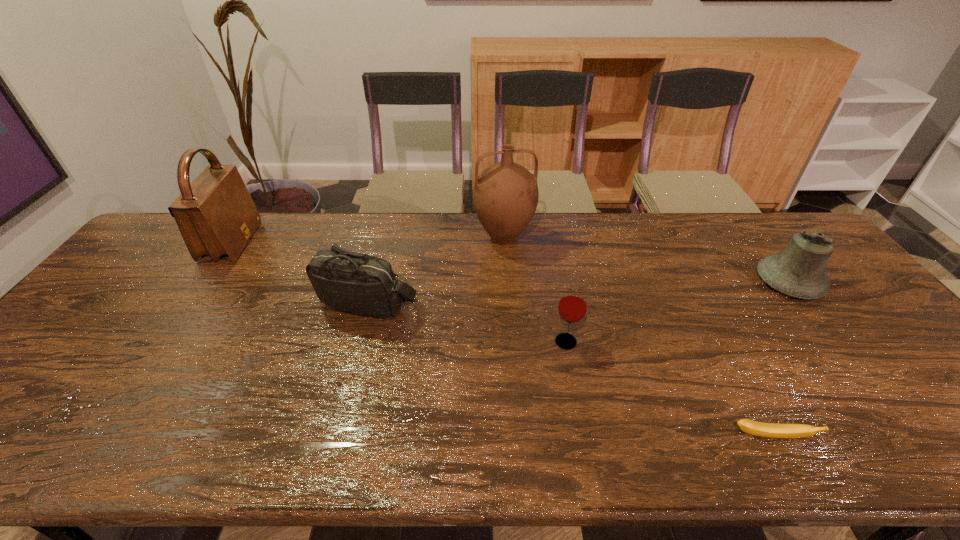
The width and height of the screenshot is (960, 540). I want to click on vacant space at the near edge of the desktop, so click(829, 436).

In order to click on vacant space at the left edge of the desktop in this screenshot , I will do `click(114, 320)`.

The width and height of the screenshot is (960, 540). In the image, there is a desktop. In order to click on vacant space at the far left corner in this screenshot , I will do `click(167, 235)`.

Find the location of `unoccupied area between the shortest object and the third object from left to right`. unoccupied area between the shortest object and the third object from left to right is located at coordinates (636, 338).

What are the coordinates of `free spot between the taller shoulder bag and the nearer shoulder bag` in the screenshot? It's located at (299, 272).

At what (x,y) coordinates should I click in order to perform the action: click on free spot between the fifth farthest object and the rightmost object. Please return your answer as a coordinate pair (x, y). The height and width of the screenshot is (540, 960). Looking at the image, I should click on (678, 312).

This screenshot has height=540, width=960. What are the coordinates of `vacant point located between the rightmost object and the fourth object from left to right` in the screenshot? It's located at (678, 312).

At what (x,y) coordinates should I click in order to perform the action: click on vacant region between the taller shoulder bag and the pitcher. Please return your answer as a coordinate pair (x, y). Looking at the image, I should click on (368, 240).

Image resolution: width=960 pixels, height=540 pixels. What are the coordinates of `free space that is in between the third object from left to right and the bell` in the screenshot? It's located at (646, 260).

This screenshot has height=540, width=960. I want to click on free spot between the third object from left to right and the fourth object from left to right, so click(535, 290).